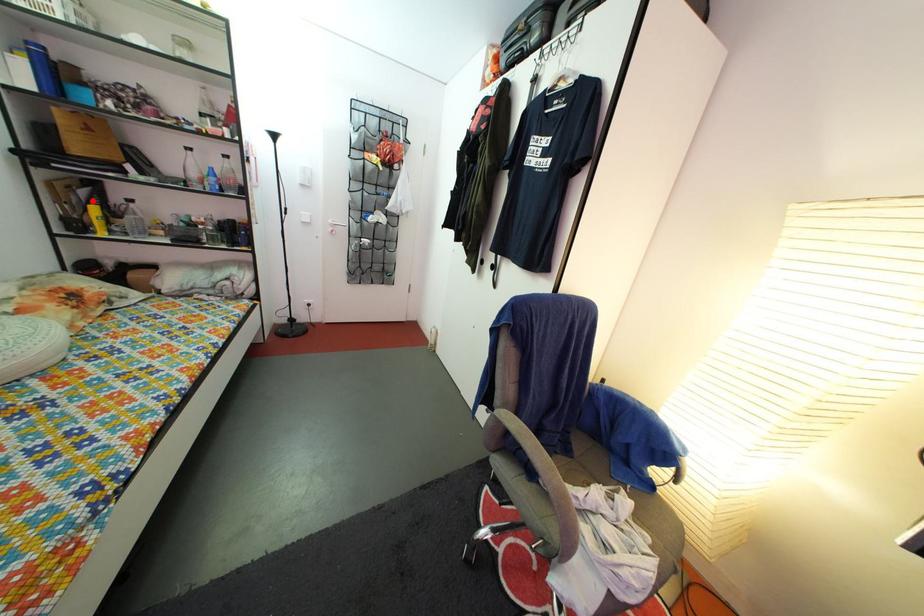
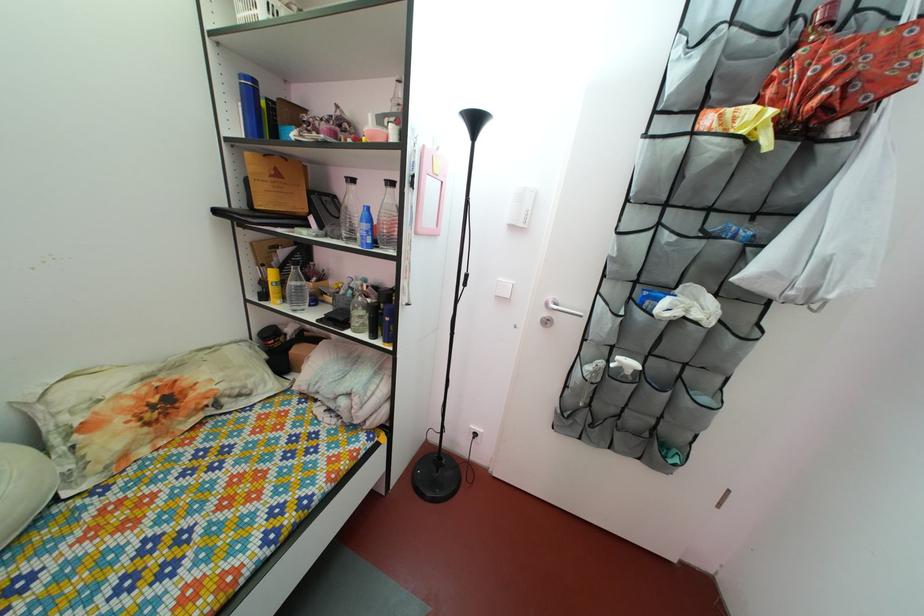
Locate, in the second image, the point that corresponds to the highlighted location in the first image.

(292, 262)